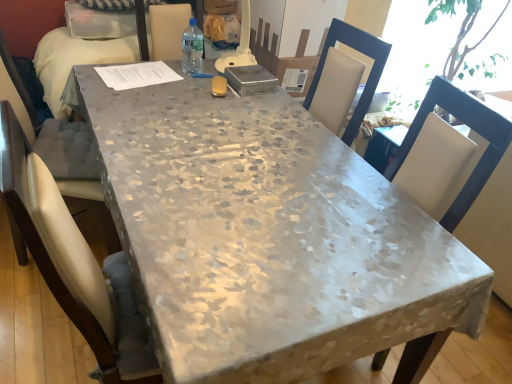
Question: Is white fabric chair at right thinner than floral-patterned fabric table at center?

Choices:
 (A) yes
 (B) no

Answer: (A)

Question: Is white fabric chair at right oriented towards floral-patterned fabric table at center?

Choices:
 (A) no
 (B) yes

Answer: (A)

Question: Is floral-patterned fabric table at center a part of white fabric chair at right?

Choices:
 (A) no
 (B) yes

Answer: (A)

Question: Is white fabric chair at right outside floral-patterned fabric table at center?

Choices:
 (A) yes
 (B) no

Answer: (A)

Question: From a real-world perspective, is white fabric chair at right positioned under floral-patterned fabric table at center based on gravity?

Choices:
 (A) no
 (B) yes

Answer: (B)

Question: Are white fabric chair at right and floral-patterned fabric table at center making contact?

Choices:
 (A) yes
 (B) no

Answer: (B)

Question: Can you confirm if floral-patterned fabric table at center is smaller than clear plastic bottle at center?

Choices:
 (A) yes
 (B) no

Answer: (B)

Question: Considering the relative positions of floral-patterned fabric table at center and clear plastic bottle at center in the image provided, is floral-patterned fabric table at center behind clear plastic bottle at center?

Choices:
 (A) no
 (B) yes

Answer: (A)

Question: Does floral-patterned fabric table at center have a greater height compared to clear plastic bottle at center?

Choices:
 (A) no
 (B) yes

Answer: (B)

Question: Is floral-patterned fabric table at center to the right of clear plastic bottle at center from the viewer's perspective?

Choices:
 (A) no
 (B) yes

Answer: (B)

Question: Is floral-patterned fabric table at center aimed at clear plastic bottle at center?

Choices:
 (A) yes
 (B) no

Answer: (B)

Question: Considering the relative sizes of floral-patterned fabric table at center and clear plastic bottle at center in the image provided, is floral-patterned fabric table at center shorter than clear plastic bottle at center?

Choices:
 (A) no
 (B) yes

Answer: (A)

Question: Is white fabric chair at right closer to the viewer compared to clear plastic bottle at center?

Choices:
 (A) yes
 (B) no

Answer: (A)